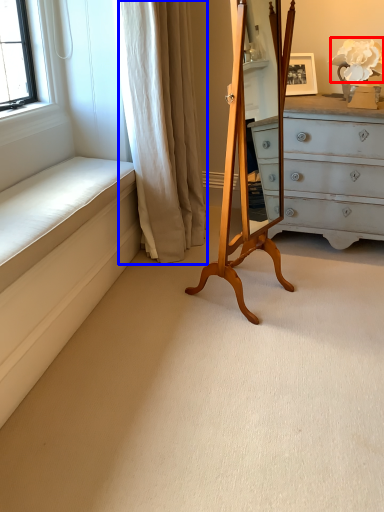
Question: Which object is closer to the camera taking this photo, flower (highlighted by a red box) or curtain (highlighted by a blue box)?

Choices:
 (A) flower
 (B) curtain

Answer: (B)